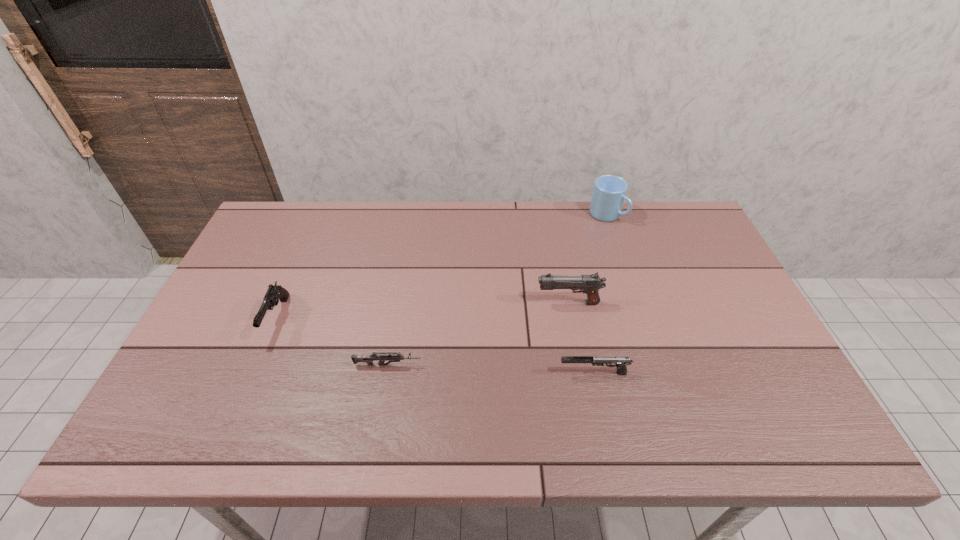
In the image, there is a desktop. At what (x,y) coordinates should I click in order to perform the action: click on vacant region at the near edge. Please return your answer as a coordinate pair (x, y). The image size is (960, 540). Looking at the image, I should click on (325, 423).

At what (x,y) coordinates should I click in order to perform the action: click on free region at the left edge of the desktop. Please return your answer as a coordinate pair (x, y). The image size is (960, 540). Looking at the image, I should click on (229, 299).

Identify the location of free region at the right edge. (749, 392).

The width and height of the screenshot is (960, 540). What are the coordinates of `vacant space at the far left corner of the desktop` in the screenshot? It's located at (254, 246).

Find the location of a particular element. This screenshot has height=540, width=960. free space that is in between the third shortest gun and the tallest gun is located at coordinates (422, 310).

Locate an element on the screen. vacant area between the tallest gun and the nearest object is located at coordinates (581, 338).

At what (x,y) coordinates should I click in order to perform the action: click on vacant area that lies between the third farthest gun and the farthest object. Please return your answer as a coordinate pair (x, y). Looking at the image, I should click on (497, 290).

You are a GUI agent. You are given a task and a screenshot of the screen. Output one action in this format:
    pyautogui.click(x=<x>, y=<y>)
    Task: Click on the vacant point located between the tallest gun and the second tallest gun
    This screenshot has width=960, height=540.
    Given the screenshot: What is the action you would take?
    pyautogui.click(x=422, y=310)

I want to click on free point between the tallest gun and the nearest object, so click(581, 338).

The height and width of the screenshot is (540, 960). I want to click on vacant space that's between the rightmost object and the nearest gun, so click(600, 294).